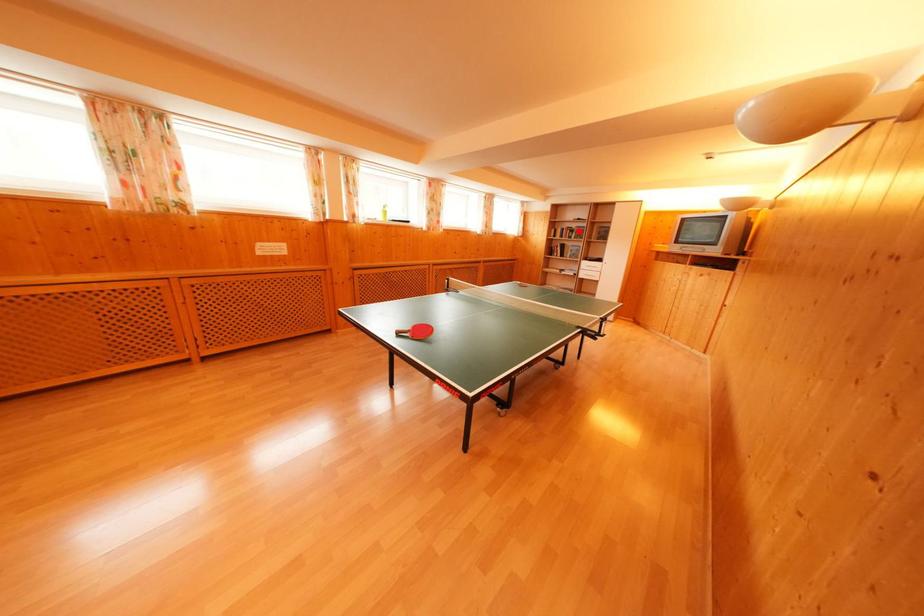
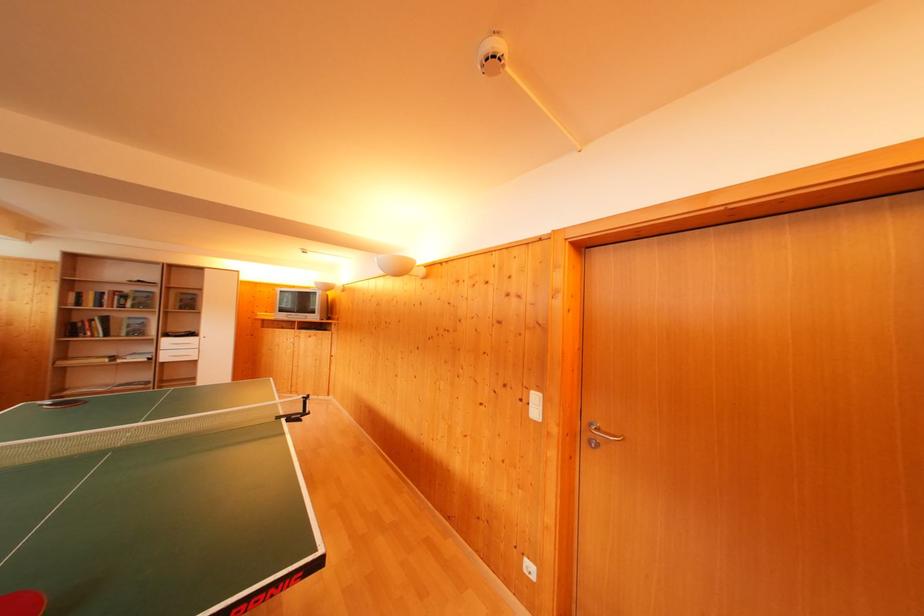
Question: I am providing you with two images of the same scene from different viewpoints. A red point is shown in image1. For the corresponding object point in image2, is it positioned nearer or farther from the camera?

Choices:
 (A) Nearer
 (B) Farther

Answer: (B)